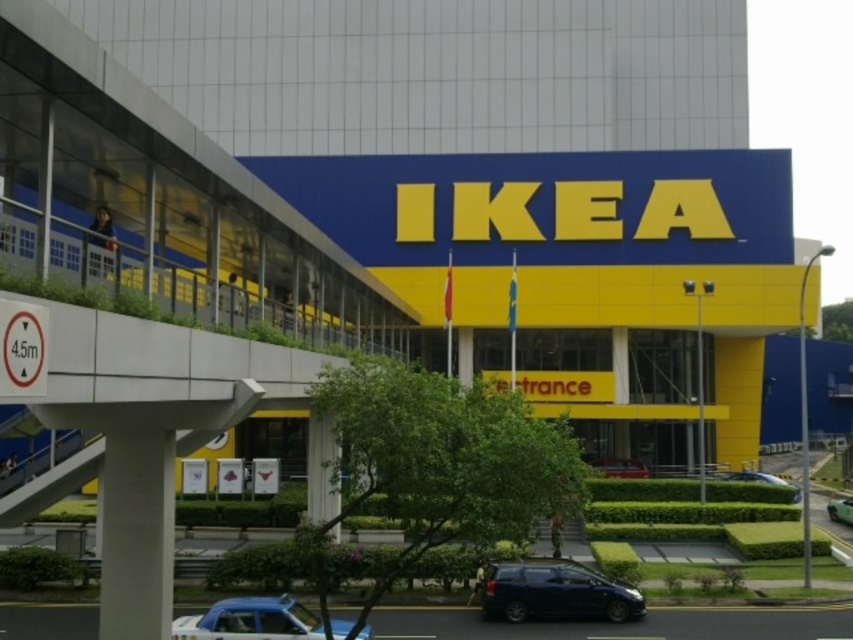
You are standing in front of the IKEA store and notice two points marked on the facade. Which point, point (550,582) or point (758,476), is closer to you?

Point (550,582) is closer to you than point (758,476).

You are standing at the entrance of the IKEA store and want to park your car. The parking lot has a designated parking spot at point A. If the metallic blue sedan at center is currently occupying the parking spot at point A, can you park your car there?

The metallic blue sedan at center is located at point A, so you cannot park your car there as it is already occupied.

You are driving a car and want to park near the IKEA store entrance. The parking lot has two available spots. One is next to the blue metallic car at lower left and the other is next to the metallic blue sedan at center. Which parking spot will give you more space around your vehicle?

The parking spot next to the blue metallic car at lower left will provide more space around your vehicle since it is larger than the metallic blue sedan at center.